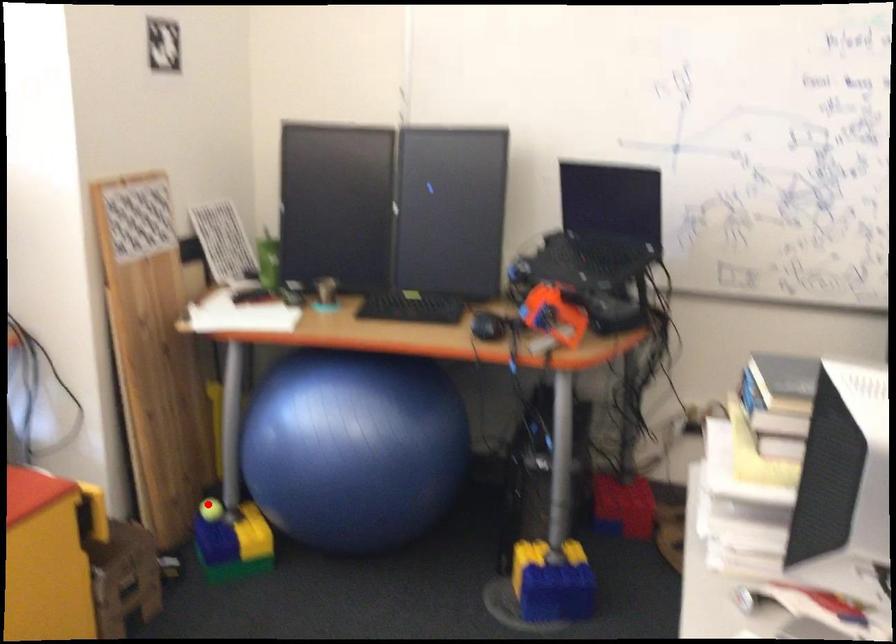
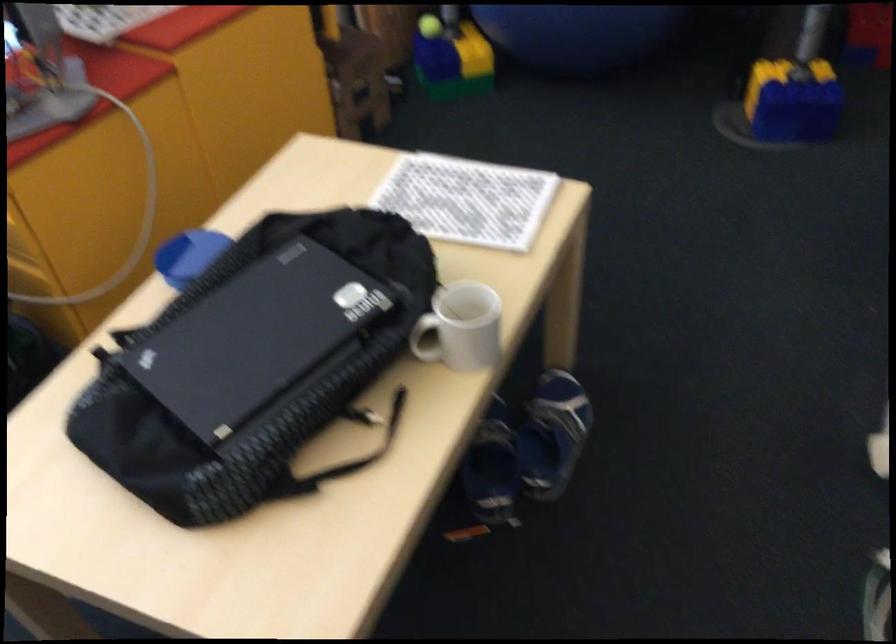
Find the pixel in the second image that matches the highlighted location in the first image.

(428, 26)